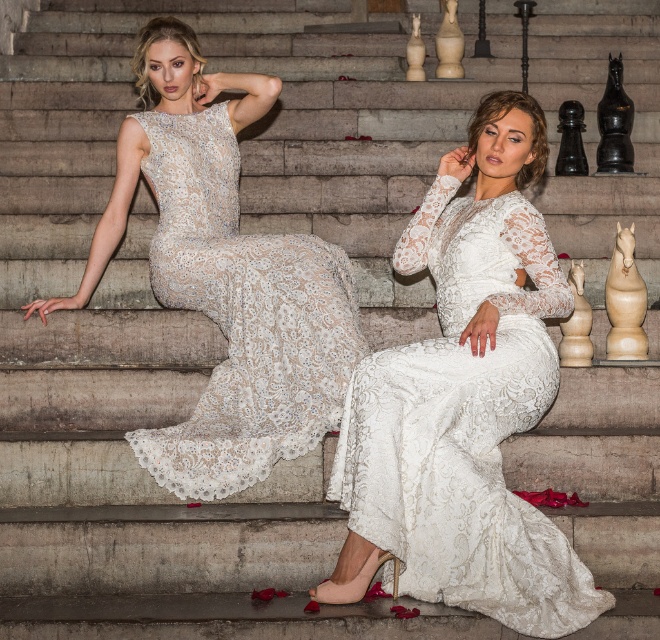
What is the location of the point with coordinates (465, 422) in relation to the white lace dress at center?

The point with coordinates (465, 422) is located on the white lace dress at center.